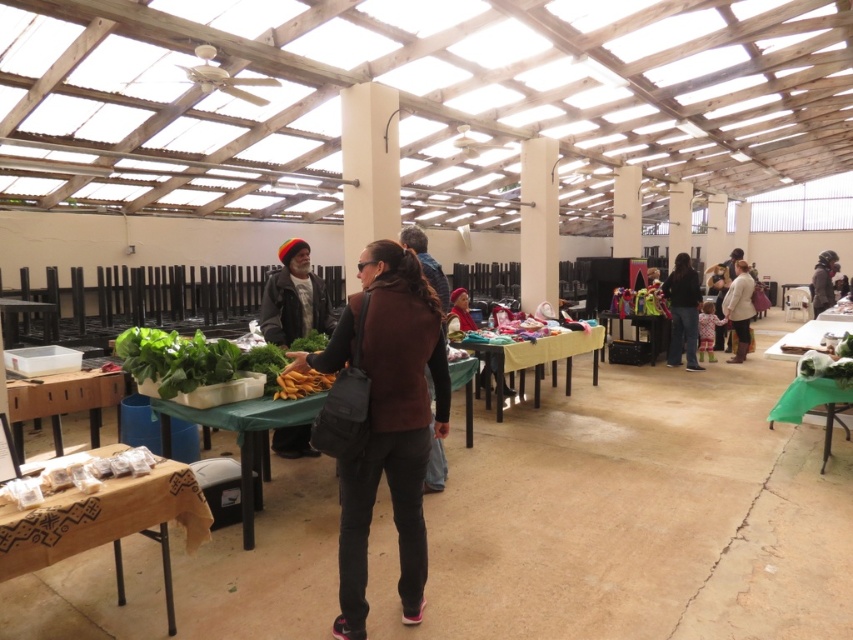
Question: Which of the following is the closest to the observer?

Choices:
 (A) black leather jacket at center
 (B) yellow fabric table at center
 (C) matte red fabric at center
 (D) green fabric table at right

Answer: (D)

Question: Is light beige coat at center-right bigger than yellow matte carrots at center?

Choices:
 (A) no
 (B) yes

Answer: (B)

Question: Can you confirm if wooden table at lower left is thinner than wooden table at center?

Choices:
 (A) no
 (B) yes

Answer: (B)

Question: Which point is farther to the camera?

Choices:
 (A) (161, 563)
 (B) (502, 394)

Answer: (B)

Question: Which object is positioned farthest from the brown woven fabric table at lower left?

Choices:
 (A) light beige coat at center-right
 (B) matte red fabric at center

Answer: (A)

Question: In this image, where is light beige coat at center-right located relative to yellow matte carrots at center?

Choices:
 (A) below
 (B) above

Answer: (B)